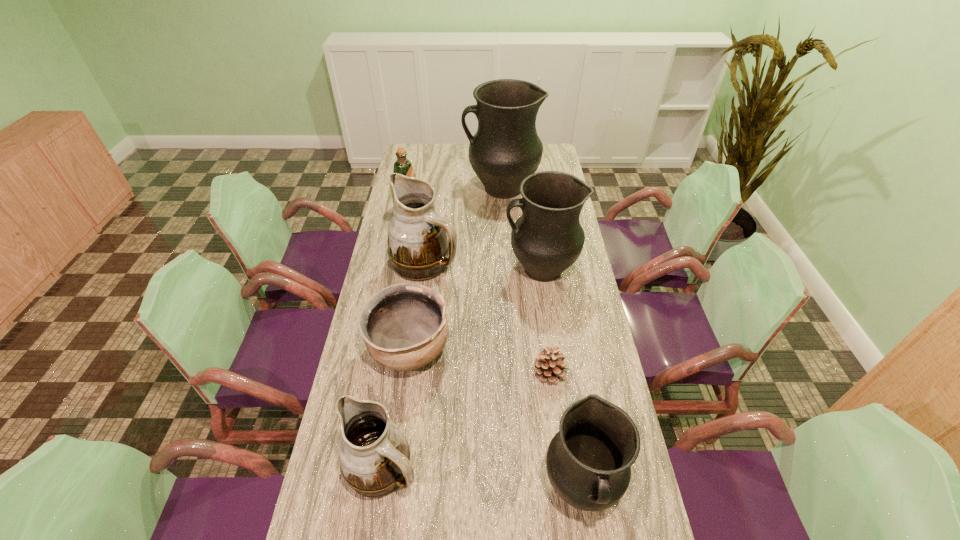
At what (x,y) coordinates should I click in order to perform the action: click on vacant point located 0.160m on the left of the shortest object. Please return your answer as a coordinate pair (x, y). Looking at the image, I should click on [x=480, y=373].

Where is `olive oil situated at the left edge`? This screenshot has width=960, height=540. olive oil situated at the left edge is located at coordinates (403, 166).

I want to click on pottery that is at the left edge, so click(404, 326).

Locate an element on the screen. pinecone that is positioned at the right edge is located at coordinates (550, 366).

You are a GUI agent. You are given a task and a screenshot of the screen. Output one action in this format:
    pyautogui.click(x=<x>, y=<y>)
    Task: Click on the blank space at the left edge of the desktop
    This screenshot has width=960, height=540.
    Given the screenshot: What is the action you would take?
    pyautogui.click(x=359, y=388)

The image size is (960, 540). In the image, there is a desktop. In order to click on free region at the far right corner in this screenshot , I will do `click(547, 151)`.

Locate an element on the screen. The width and height of the screenshot is (960, 540). vacant area that lies between the second farthest black pitcher and the pinecone is located at coordinates (545, 321).

Locate an element on the screen. unoccupied area between the nearer brown pitcher and the shortest object is located at coordinates (468, 420).

Find the location of a particular element. The height and width of the screenshot is (540, 960). unoccupied position between the smallest black pitcher and the nearer brown pitcher is located at coordinates (482, 477).

Identify the location of free space between the brown pinecone and the seventh tallest object. (480, 361).